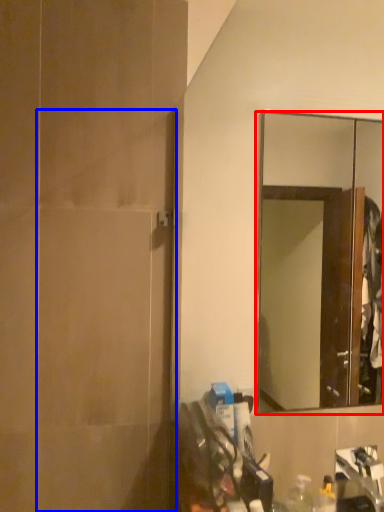
Question: Which object is further to the camera taking this photo, mirror (highlighted by a red box) or screen door (highlighted by a blue box)?

Choices:
 (A) mirror
 (B) screen door

Answer: (A)